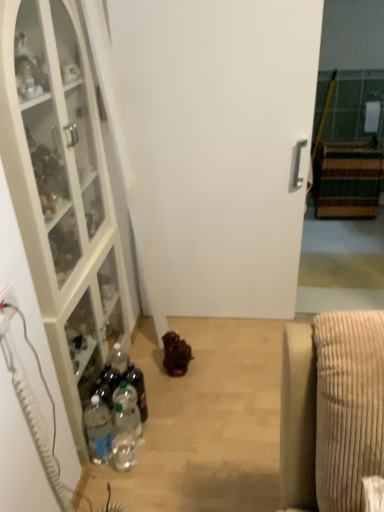
Question: Is white matte door at center shorter than white plastic electric outlet at lower left?

Choices:
 (A) no
 (B) yes

Answer: (A)

Question: Is white matte door at center to the left of white plastic electric outlet at lower left from the viewer's perspective?

Choices:
 (A) yes
 (B) no

Answer: (B)

Question: Is white matte door at center not inside white plastic electric outlet at lower left?

Choices:
 (A) yes
 (B) no

Answer: (A)

Question: Does white matte door at center turn towards white plastic electric outlet at lower left?

Choices:
 (A) yes
 (B) no

Answer: (A)

Question: Are white matte door at center and white plastic electric outlet at lower left beside each other?

Choices:
 (A) no
 (B) yes

Answer: (A)

Question: In the image, is clear plastic bottle at lower left, which is the 1th bottle in left-to-right order, positioned in front of or behind clear plastic bottle at lower left, the 2th bottle positioned from the left?

Choices:
 (A) behind
 (B) front

Answer: (B)

Question: Based on their positions, is clear plastic bottle at lower left, which is the 3th bottle from right to left, located to the left or right of clear plastic bottle at lower left, marked as the second bottle in a right-to-left arrangement?

Choices:
 (A) left
 (B) right

Answer: (A)

Question: In terms of size, does clear plastic bottle at lower left, which is the 1th bottle in left-to-right order, appear bigger or smaller than clear plastic bottle at lower left, the 2th bottle positioned from the left?

Choices:
 (A) small
 (B) big

Answer: (B)

Question: Do you think clear plastic bottle at lower left, which is the 1th bottle in left-to-right order, is within clear plastic bottle at lower left, the 2th bottle positioned from the left, or outside of it?

Choices:
 (A) inside
 (B) outside

Answer: (B)

Question: Is clear plastic bottle at lower left, marked as the second bottle in a right-to-left arrangement, inside or outside of clear plastic bottle at lower left, which is the 1th bottle in left-to-right order?

Choices:
 (A) inside
 (B) outside

Answer: (B)

Question: Considering the positions of clear plastic bottle at lower left, marked as the second bottle in a right-to-left arrangement, and clear plastic bottle at lower left, which is the 3th bottle from right to left, in the image, is clear plastic bottle at lower left, marked as the second bottle in a right-to-left arrangement, wider or thinner than clear plastic bottle at lower left, which is the 3th bottle from right to left,?

Choices:
 (A) wide
 (B) thin

Answer: (B)

Question: Considering their positions, is clear plastic bottle at lower left, marked as the second bottle in a right-to-left arrangement, located in front of or behind clear plastic bottle at lower left, which is the 3th bottle from right to left?

Choices:
 (A) front
 (B) behind

Answer: (B)

Question: Based on their sizes in the image, would you say clear plastic bottle at lower left, marked as the second bottle in a right-to-left arrangement, is bigger or smaller than clear plastic bottle at lower left, which is the 3th bottle from right to left?

Choices:
 (A) big
 (B) small

Answer: (B)

Question: Considering the positions of clear plastic bottle at center, the 3th bottle in the left-to-right sequence, and clear plastic bottle at lower left, which is the 1th bottle in left-to-right order, in the image, is clear plastic bottle at center, the 3th bottle in the left-to-right sequence, taller or shorter than clear plastic bottle at lower left, which is the 1th bottle in left-to-right order,?

Choices:
 (A) tall
 (B) short

Answer: (B)

Question: In terms of width, does clear plastic bottle at center, the 3th bottle in the left-to-right sequence, look wider or thinner when compared to clear plastic bottle at lower left, which is the 3th bottle from right to left?

Choices:
 (A) thin
 (B) wide

Answer: (A)